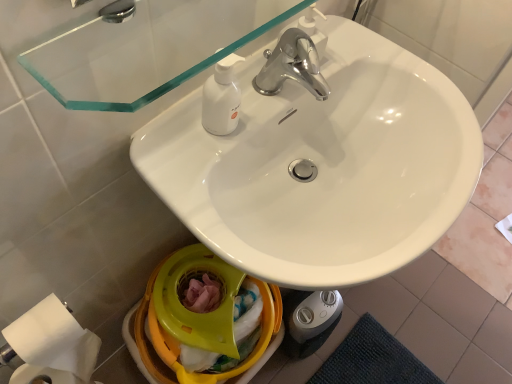
Locate an element on the screen. The image size is (512, 384). blank area beneath transparent glass mirror at upper center (from a real-world perspective) is located at coordinates (183, 142).